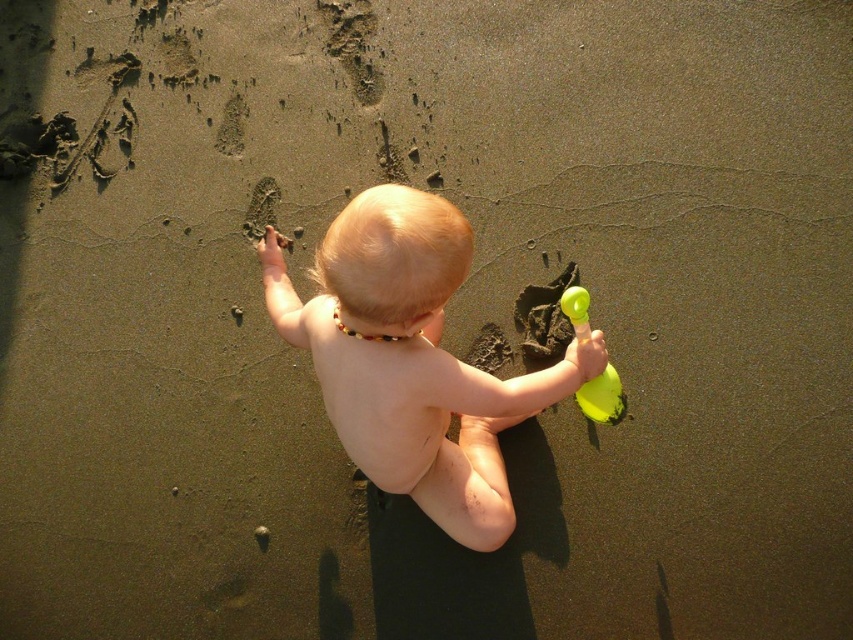
Measure the distance between smooth skin baby at center and camera.

smooth skin baby at center and camera are 4.54 feet apart from each other.

Which is behind, point (467, 449) or point (577, 333)?

Positioned behind is point (467, 449).

Locate an element on the screen. This screenshot has width=853, height=640. smooth skin baby at center is located at coordinates (412, 358).